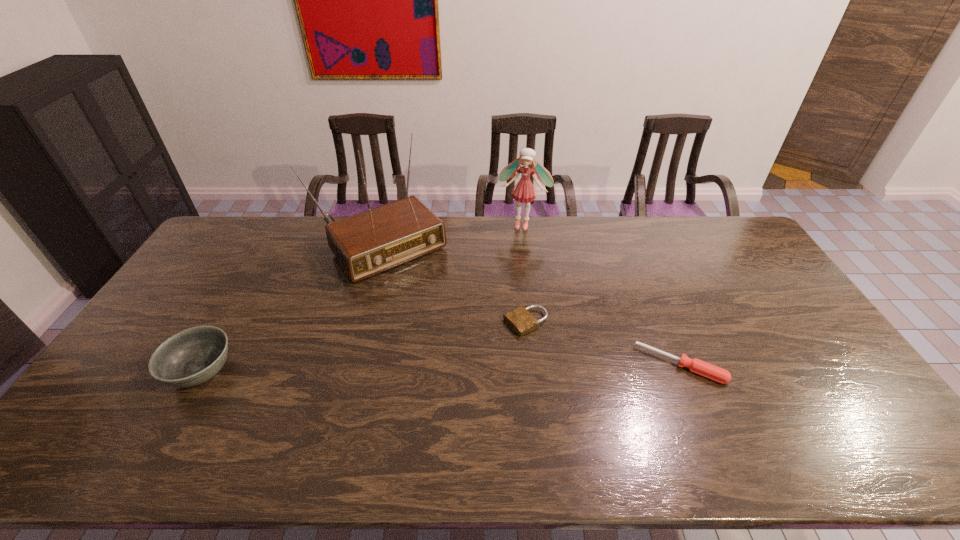
You are a GUI agent. You are given a task and a screenshot of the screen. Output one action in this format:
    pyautogui.click(x=<x>, y=<y>)
    Task: Click on the vacant spot on the desktop that is between the third shortest object and the rightmost object and is positioned on the keyhole side of the padlock
    The height and width of the screenshot is (540, 960).
    Given the screenshot: What is the action you would take?
    pyautogui.click(x=435, y=368)

Where is `vacant spot on the desktop that is between the third shortest object and the screwdriver and is positioned on the front panel of the fourth object from right to left`? The width and height of the screenshot is (960, 540). vacant spot on the desktop that is between the third shortest object and the screwdriver and is positioned on the front panel of the fourth object from right to left is located at coordinates (478, 368).

This screenshot has height=540, width=960. In order to click on vacant space on the desktop that is between the leftmost object and the rightmost object and is positioned on the front-facing side of the doll in this screenshot , I will do `click(486, 368)`.